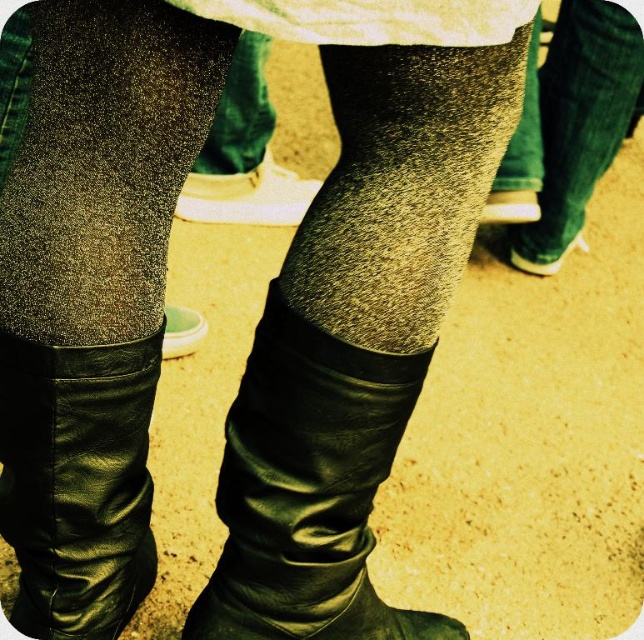
Question: From the image, what is the correct spatial relationship of black leather boot at center in relation to textured gray sock at center?

Choices:
 (A) above
 (B) below

Answer: (B)

Question: Estimate the real-world distances between objects in this image. Which object is farther from the green suede shoe at lower right?

Choices:
 (A) black leather boot at center
 (B) sparkly metallic tights at center
 (C) black leather boot at lower center

Answer: (B)

Question: Considering the real-world distances, which object is farthest from the green suede shoe at lower right?

Choices:
 (A) sparkly metallic tights at center
 (B) black leather boot at lower center
 (C) matte white shoe at center
 (D) textured gray sock at center

Answer: (A)

Question: Which object is closer to the camera taking this photo?

Choices:
 (A) black leather boot at lower center
 (B) matte black shoe at center

Answer: (A)

Question: Is sparkly metallic tights at center below matte black shoe at center?

Choices:
 (A) no
 (B) yes

Answer: (B)

Question: Does sparkly metallic tights at center have a lesser width compared to matte white shoe at center?

Choices:
 (A) no
 (B) yes

Answer: (B)